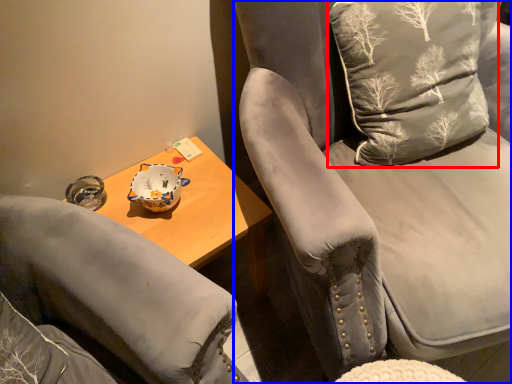
Question: Which of the following is the closest to the observer, throw pillow (highlighted by a red box) or chair (highlighted by a blue box)?

Choices:
 (A) throw pillow
 (B) chair

Answer: (B)